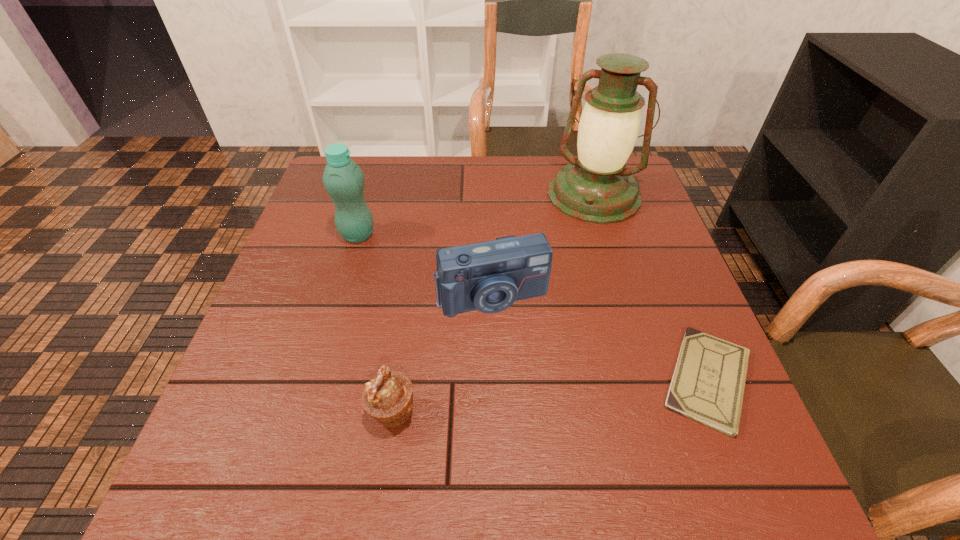
The width and height of the screenshot is (960, 540). I want to click on muffin that is at the near edge, so click(x=388, y=397).

In order to click on checkbook located in the near edge section of the desktop in this screenshot , I will do `click(708, 383)`.

Locate an element on the screen. Image resolution: width=960 pixels, height=540 pixels. object situated at the left edge is located at coordinates (343, 179).

The height and width of the screenshot is (540, 960). In order to click on checkbook located at the right edge in this screenshot , I will do point(708,383).

Where is `lantern at the right edge`? Image resolution: width=960 pixels, height=540 pixels. lantern at the right edge is located at coordinates (595, 187).

At what (x,y) coordinates should I click in order to perform the action: click on object that is at the far right corner. Please return your answer as a coordinate pair (x, y). The image size is (960, 540). Looking at the image, I should click on (595, 187).

Locate an element on the screen. object situated at the near right corner is located at coordinates (708, 383).

Locate an element on the screen. This screenshot has height=540, width=960. vacant space at the far edge of the desktop is located at coordinates (529, 179).

The width and height of the screenshot is (960, 540). I want to click on free region at the left edge of the desktop, so click(x=302, y=373).

Identify the location of vacant space at the right edge. (650, 277).